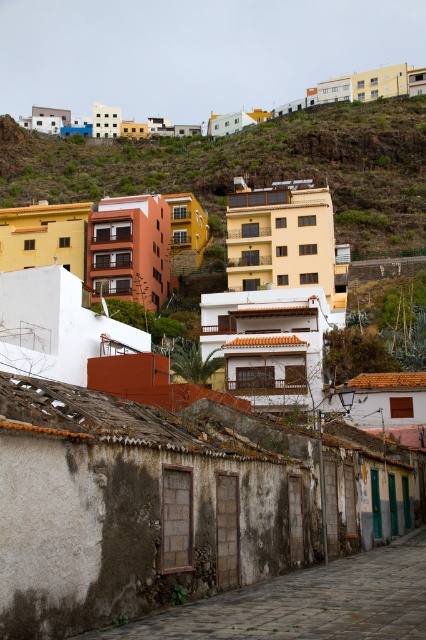
Who is more forward, (201, 202) or (121, 636)?

Point (121, 636) is more forward.

Who is more distant from viewer, (x=409, y=163) or (x=230, y=611)?

The point (x=409, y=163) is behind.

This screenshot has height=640, width=426. Find the location of `yellow matte building at upper center`. yellow matte building at upper center is located at coordinates (249, 166).

This screenshot has height=640, width=426. What are the coordinates of `yellow matte building at upper center` in the screenshot? It's located at (249, 166).

Is yellow matte building at upper center positioned in front of pastel painted houses at upper left?

Yes, it is in front of pastel painted houses at upper left.

What do you see at coordinates (249, 166) in the screenshot? I see `yellow matte building at upper center` at bounding box center [249, 166].

Identify the location of yellow matte building at upper center. (249, 166).

Which is in front, point (265, 611) or point (20, 124)?

Positioned in front is point (265, 611).

Is rusty stone alley at lower center wider than pastel painted houses at upper left?

No, rusty stone alley at lower center is not wider than pastel painted houses at upper left.

Identify the location of rusty stone alley at lower center. This screenshot has width=426, height=640. (305, 604).